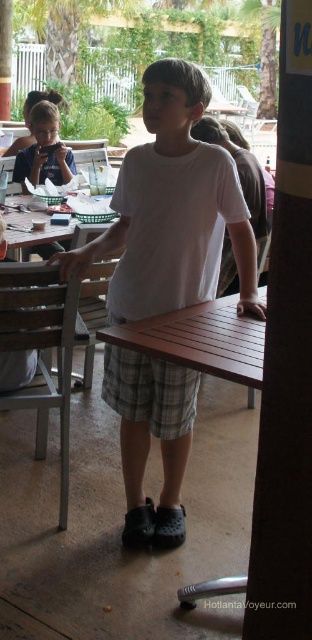
Does white cotton shirt at center lie in front of brown wooden picnic table at center?

No, it is not.

The width and height of the screenshot is (312, 640). I want to click on white cotton shirt at center, so 172,209.

Where is `brown wooden picnic table at center`? The height and width of the screenshot is (640, 312). brown wooden picnic table at center is located at coordinates (204, 340).

From the picture: Which is more to the right, brown wooden picnic table at center or brown wooden table at center?

Positioned to the right is brown wooden table at center.

Where is `brown wooden picnic table at center`? brown wooden picnic table at center is located at coordinates (204, 340).

Can you confirm if white cotton shirt at center is bigger than brown wooden table at center?

Yes, white cotton shirt at center is bigger than brown wooden table at center.

Can you confirm if white cotton shirt at center is wider than brown wooden table at center?

Yes.

This screenshot has width=312, height=640. In order to click on white cotton shirt at center in this screenshot , I will do `click(172, 209)`.

Locate an element on the screen. The width and height of the screenshot is (312, 640). white cotton shirt at center is located at coordinates (172, 209).